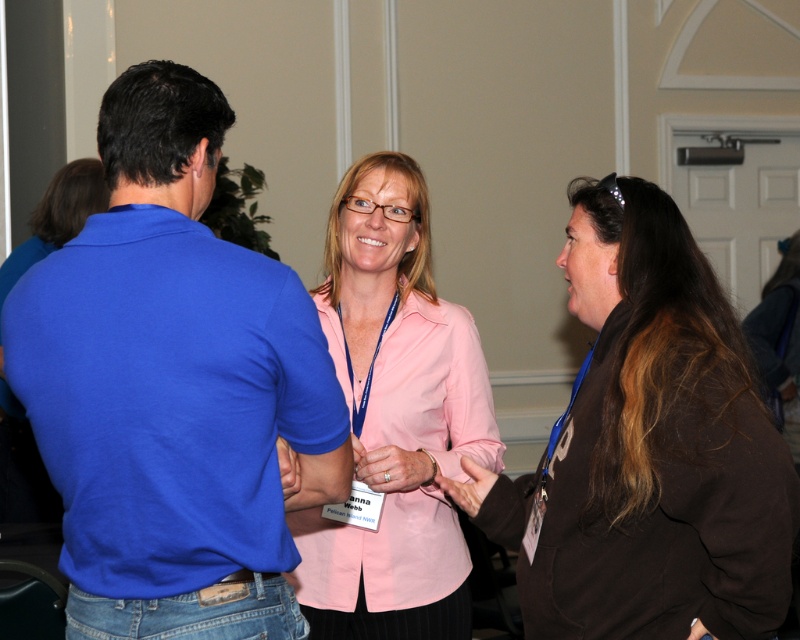
Is point (284, 541) more distant than point (652, 401)?

That is False.

Can you confirm if blue cotton polo shirt at left is taller than brown soft fabric shirt at center?

Indeed, blue cotton polo shirt at left has a greater height compared to brown soft fabric shirt at center.

Is point (90, 472) farther from camera compared to point (768, 547)?

No, it is not.

Locate an element on the screen. Image resolution: width=800 pixels, height=640 pixels. blue cotton polo shirt at left is located at coordinates [173, 387].

Between blue cotton polo shirt at left and pink fabric shirt at center, which one has more height?

With more height is pink fabric shirt at center.

Does blue cotton polo shirt at left appear over pink fabric shirt at center?

Yes, blue cotton polo shirt at left is above pink fabric shirt at center.

The height and width of the screenshot is (640, 800). Find the location of `blue cotton polo shirt at left`. blue cotton polo shirt at left is located at coordinates (173, 387).

Which of these two, brown soft fabric shirt at center or pink fabric shirt at center, stands taller?

With more height is pink fabric shirt at center.

Who is positioned more to the left, brown soft fabric shirt at center or pink fabric shirt at center?

pink fabric shirt at center

Locate an element on the screen. This screenshot has height=640, width=800. brown soft fabric shirt at center is located at coordinates (648, 448).